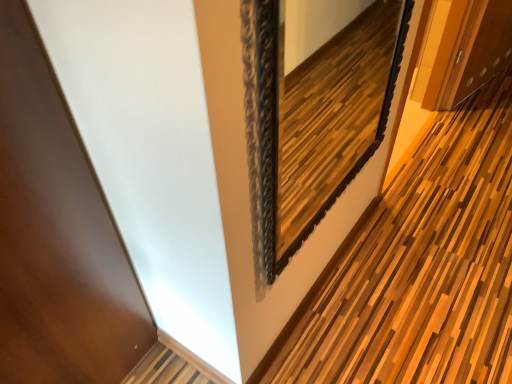
The width and height of the screenshot is (512, 384). I want to click on black ornate mirror at upper center, so click(x=312, y=119).

Describe the element at coordinates (312, 119) in the screenshot. I see `black ornate mirror at upper center` at that location.

Locate an element on the screen. The image size is (512, 384). wooden slats at center is located at coordinates (419, 268).

Image resolution: width=512 pixels, height=384 pixels. Describe the element at coordinates (419, 268) in the screenshot. I see `wooden slats at center` at that location.

What are the coordinates of `black ornate mirror at upper center` in the screenshot? It's located at (312, 119).

Considering the positions of objects wooden slats at center and black ornate mirror at upper center in the image provided, who is more to the right, wooden slats at center or black ornate mirror at upper center?

From the viewer's perspective, wooden slats at center appears more on the right side.

Considering their positions, is wooden slats at center located in front of or behind black ornate mirror at upper center?

In the image, wooden slats at center appears behind black ornate mirror at upper center.

Considering the positions of point (390, 330) and point (362, 39), is point (390, 330) closer or farther from the camera than point (362, 39)?

Point (390, 330).

From the image's perspective, is wooden slats at center positioned above or below black ornate mirror at upper center?

From the image's perspective, wooden slats at center appears below black ornate mirror at upper center.

From a real-world perspective, relative to black ornate mirror at upper center, is wooden slats at center vertically above or below?

wooden slats at center is below black ornate mirror at upper center.

Based on the photo, does wooden slats at center have a lesser width compared to black ornate mirror at upper center?

Indeed, wooden slats at center has a lesser width compared to black ornate mirror at upper center.

In terms of height, does wooden slats at center look taller or shorter compared to black ornate mirror at upper center?

wooden slats at center is shorter than black ornate mirror at upper center.

Based on their sizes in the image, would you say wooden slats at center is bigger or smaller than black ornate mirror at upper center?

In the image, wooden slats at center appears to be smaller than black ornate mirror at upper center.

Could black ornate mirror at upper center be considered to be inside wooden slats at center?

Definitely not — black ornate mirror at upper center is not inside wooden slats at center.

Is wooden slats at center far from black ornate mirror at upper center?

No, wooden slats at center is not far away from black ornate mirror at upper center.

Is wooden slats at center oriented away from black ornate mirror at upper center?

That's not correct — wooden slats at center is not looking away from black ornate mirror at upper center.

Find the location of a particular element. path behind the black ornate mirror at upper center is located at coordinates 419,268.

Does black ornate mirror at upper center appear on the right side of wooden slats at center?

In fact, black ornate mirror at upper center is to the left of wooden slats at center.

Which is in front, black ornate mirror at upper center or wooden slats at center?

black ornate mirror at upper center is more forward.

Is point (306, 199) positioned after point (422, 381)?

Yes, it is.

From the image's perspective, which one is positioned lower, black ornate mirror at upper center or wooden slats at center?

wooden slats at center is shown below in the image.

From a real-world perspective, is black ornate mirror at upper center below wooden slats at center?

Incorrect, from a real-world perspective, black ornate mirror at upper center is higher than wooden slats at center.

Does black ornate mirror at upper center have a lesser width compared to wooden slats at center?

Incorrect, the width of black ornate mirror at upper center is not less than that of wooden slats at center.

From their relative heights in the image, would you say black ornate mirror at upper center is taller or shorter than wooden slats at center?

black ornate mirror at upper center is taller than wooden slats at center.

Considering the relative sizes of black ornate mirror at upper center and wooden slats at center in the image provided, is black ornate mirror at upper center smaller than wooden slats at center?

No.

Is black ornate mirror at upper center not inside wooden slats at center?

Yes, black ornate mirror at upper center is not within wooden slats at center.

Can you see black ornate mirror at upper center touching wooden slats at center?

black ornate mirror at upper center is not next to wooden slats at center, and they're not touching.

Is black ornate mirror at upper center oriented away from wooden slats at center?

black ornate mirror at upper center does not have its back to wooden slats at center.

How different are the orientations of black ornate mirror at upper center and wooden slats at center in degrees?

There is a 1.12-degree angle between the facing directions of black ornate mirror at upper center and wooden slats at center.

How distant is black ornate mirror at upper center from wooden slats at center?

23.81 inches.

Locate an element on the screen. This screenshot has height=384, width=512. path lying behind the black ornate mirror at upper center is located at coordinates (419, 268).

Find the location of a particular element. This screenshot has width=512, height=384. path behind the black ornate mirror at upper center is located at coordinates (419, 268).

Where is `path on the right of black ornate mirror at upper center`? The image size is (512, 384). path on the right of black ornate mirror at upper center is located at coordinates (419, 268).